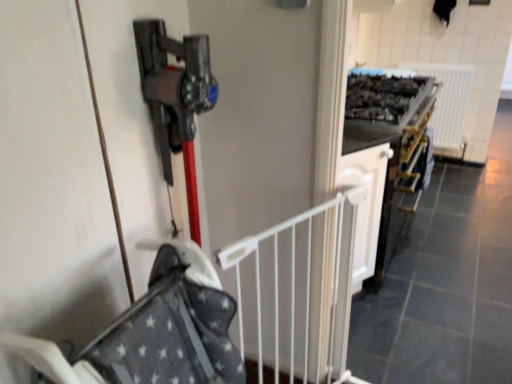
Question: From the image's perspective, does gray fabric baby carriage at center appear lower than white plastic radiator at upper right?

Choices:
 (A) yes
 (B) no

Answer: (A)

Question: Is gray fabric baby carriage at center further to the viewer compared to white plastic radiator at upper right?

Choices:
 (A) no
 (B) yes

Answer: (A)

Question: Could you tell me if gray fabric baby carriage at center is turned towards white plastic radiator at upper right?

Choices:
 (A) no
 (B) yes

Answer: (A)

Question: From a real-world perspective, is gray fabric baby carriage at center over white plastic radiator at upper right?

Choices:
 (A) no
 (B) yes

Answer: (B)

Question: Is gray fabric baby carriage at center not close to white plastic radiator at upper right?

Choices:
 (A) yes
 (B) no

Answer: (A)

Question: From a real-world perspective, is white metal gate at center positioned above or below white plastic radiator at upper right?

Choices:
 (A) below
 (B) above

Answer: (B)

Question: Which is correct: white metal gate at center is inside white plastic radiator at upper right, or outside of it?

Choices:
 (A) inside
 (B) outside

Answer: (B)

Question: In terms of height, does white metal gate at center look taller or shorter compared to white plastic radiator at upper right?

Choices:
 (A) short
 (B) tall

Answer: (B)

Question: Looking at their shapes, would you say white metal gate at center is wider or thinner than white plastic radiator at upper right?

Choices:
 (A) thin
 (B) wide

Answer: (A)

Question: Would you say white plastic radiator at upper right is inside or outside gray fabric baby carriage at center?

Choices:
 (A) outside
 (B) inside

Answer: (A)

Question: Considering the positions of white plastic radiator at upper right and gray fabric baby carriage at center in the image, is white plastic radiator at upper right taller or shorter than gray fabric baby carriage at center?

Choices:
 (A) short
 (B) tall

Answer: (B)

Question: In the image, is white plastic radiator at upper right on the left side or the right side of gray fabric baby carriage at center?

Choices:
 (A) left
 (B) right

Answer: (B)

Question: Considering the positions of white plastic radiator at upper right and gray fabric baby carriage at center in the image, is white plastic radiator at upper right bigger or smaller than gray fabric baby carriage at center?

Choices:
 (A) small
 (B) big

Answer: (A)

Question: In the image, is white metal gate at center on the left side or the right side of gray fabric baby carriage at center?

Choices:
 (A) left
 (B) right

Answer: (B)

Question: In terms of height, does white metal gate at center look taller or shorter compared to gray fabric baby carriage at center?

Choices:
 (A) short
 (B) tall

Answer: (B)